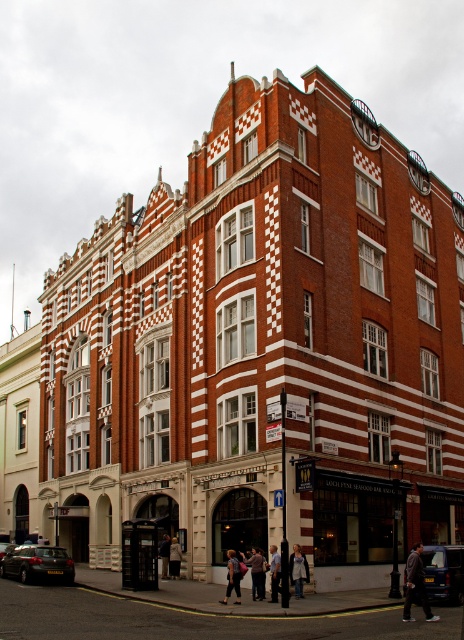
You are standing in front of the building and want to take a photo. You notice two points marked on the facade. Which point, point 1 at coordinates (31, 557) or point 2 at coordinates (176, 573), is closer to your camera lens?

Point 1 at coordinates (31, 557) is closer to the camera lens than point 2 at coordinates (176, 573).

You are a delivery person who needs to place a package between the light brown leather jacket at lower center and the light beige fabric coat at lower center. Is it possible to place the package between them?

The light brown leather jacket at lower center is in front of the light beige fabric coat at lower center, so there is no space between them for placing the package.